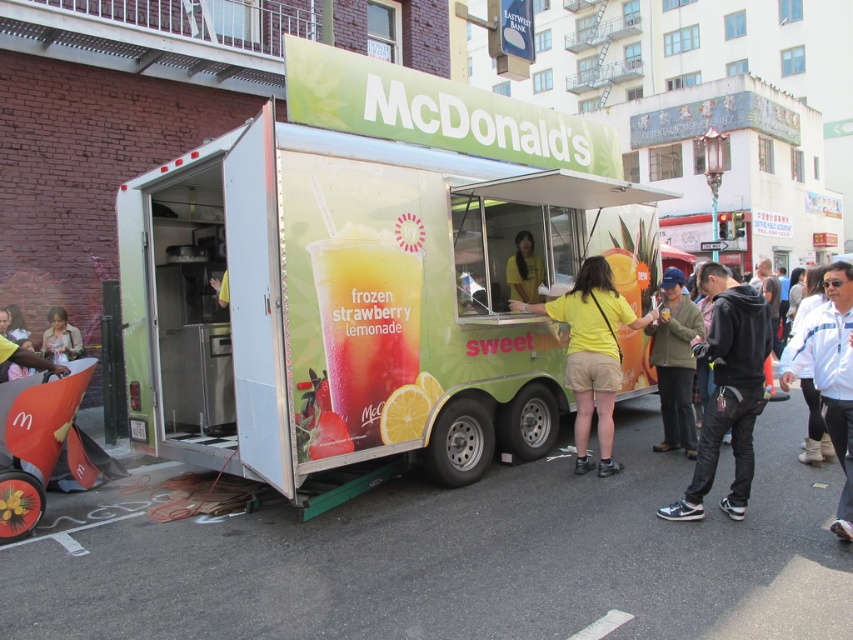
Consider the image. You are a customer waiting in line at the McDonalds food truck. You notice two people in front of you wearing a yellow cotton shirt at center and a green textured jacket at center. Which customer is standing to the left of the other?

The yellow cotton shirt at center is positioned on the left side of green textured jacket at center, so the customer wearing the yellow cotton shirt at center is standing to the left of the one in the green textured jacket at center.